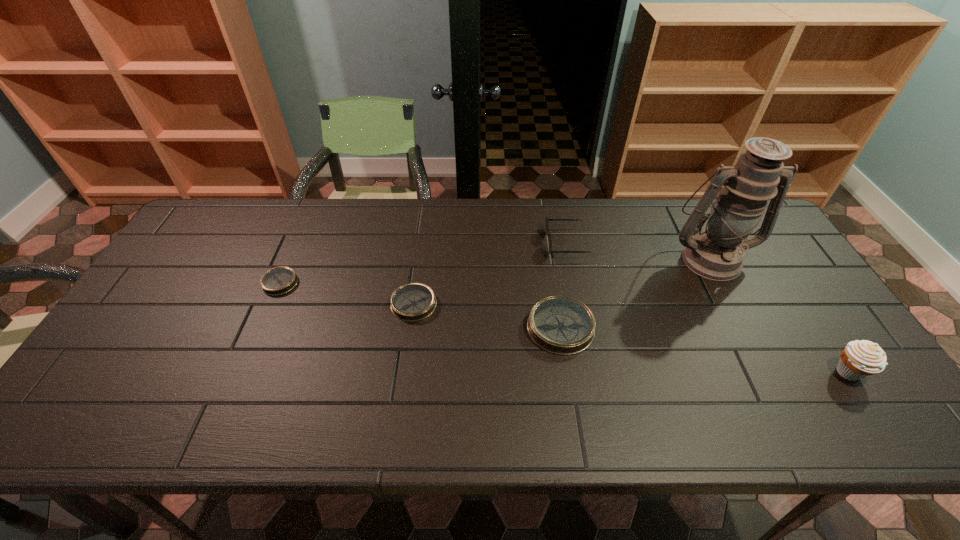
Point out which object is positioned as the fourth nearest to the third shortest object. Please provide its 2D coordinates. Your answer should be formatted as a tuple, i.e. [(x, y)], where the tuple contains the x and y coordinates of a point satisfying the conditions above.

[(859, 359)]

You are a GUI agent. You are given a task and a screenshot of the screen. Output one action in this format:
    pyautogui.click(x=<x>, y=<y>)
    Task: Click on the compass that is the closest to the fifth shortest object
    The image size is (960, 540).
    Given the screenshot: What is the action you would take?
    pyautogui.click(x=561, y=325)

Locate an element on the screen. compass object that ranks as the closest to the oil lamp is located at coordinates (561, 325).

Where is `vacant area in the image that satisfies the following two spatial constraints: 1. on the front side of the rightmost compass; 2. on the right side of the nearest object`? The height and width of the screenshot is (540, 960). vacant area in the image that satisfies the following two spatial constraints: 1. on the front side of the rightmost compass; 2. on the right side of the nearest object is located at coordinates (568, 373).

Locate an element on the screen. vacant area that satisfies the following two spatial constraints: 1. on the front-facing side of the oil lamp; 2. on the left side of the sunglasses is located at coordinates (569, 259).

Find the location of a particular element. This screenshot has height=540, width=960. vacant area in the image that satisfies the following two spatial constraints: 1. on the back side of the second tallest object; 2. on the front-facing side of the sunglasses is located at coordinates (762, 243).

Locate an element on the screen. The width and height of the screenshot is (960, 540). blank space that satisfies the following two spatial constraints: 1. on the front side of the second tallest object; 2. on the left side of the oil lamp is located at coordinates (770, 373).